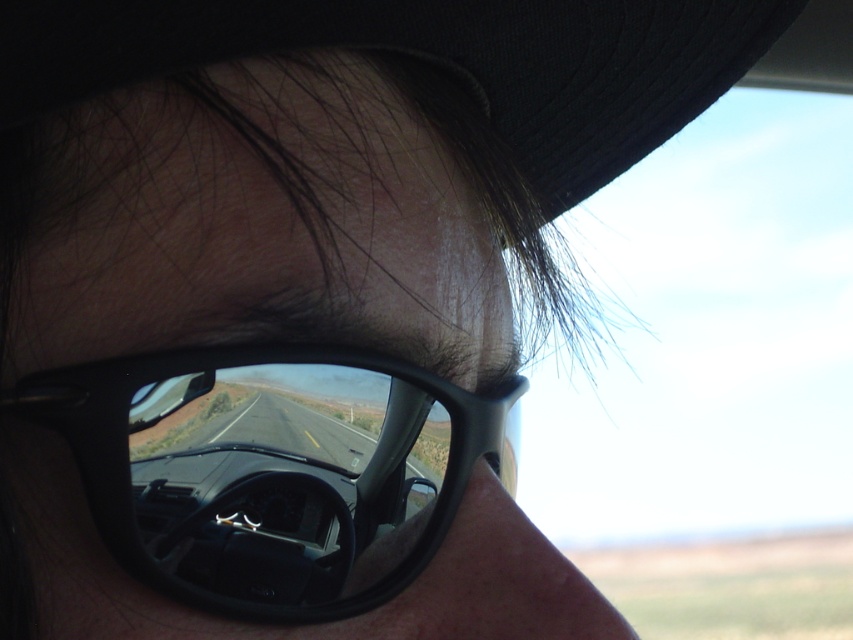
Is black plastic sunglasses at center above black fabric baseball hat at upper center?

No, black plastic sunglasses at center is not above black fabric baseball hat at upper center.

Is black plastic sunglasses at center to the right of black fabric baseball hat at upper center from the viewer's perspective?

No, black plastic sunglasses at center is not to the right of black fabric baseball hat at upper center.

I want to click on black plastic sunglasses at center, so click(x=270, y=468).

Find the location of a particular element. This screenshot has height=640, width=853. black plastic sunglasses at center is located at coordinates (270, 468).